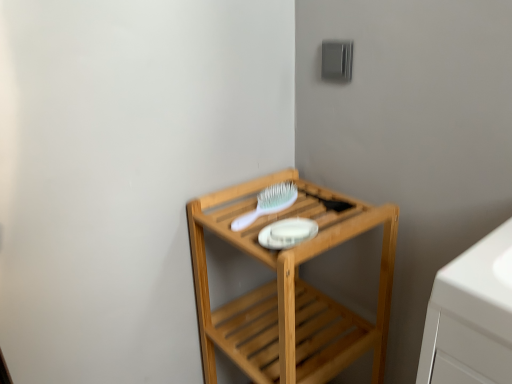
Question: Can you confirm if natural wood shelf at center is taller than white plastic brush at upper center?

Choices:
 (A) yes
 (B) no

Answer: (A)

Question: From the image's perspective, does natural wood shelf at center appear higher than white plastic brush at upper center?

Choices:
 (A) yes
 (B) no

Answer: (B)

Question: From a real-world perspective, is natural wood shelf at center beneath white plastic brush at upper center?

Choices:
 (A) yes
 (B) no

Answer: (A)

Question: Considering the relative positions of natural wood shelf at center and white plastic brush at upper center in the image provided, is natural wood shelf at center to the right of white plastic brush at upper center from the viewer's perspective?

Choices:
 (A) yes
 (B) no

Answer: (A)

Question: Does natural wood shelf at center turn towards white plastic brush at upper center?

Choices:
 (A) no
 (B) yes

Answer: (A)

Question: Is natural wood shelf at center positioned with its back to white plastic brush at upper center?

Choices:
 (A) no
 (B) yes

Answer: (A)

Question: Does white plastic brush at upper center have a lesser width compared to natural wood shelf at center?

Choices:
 (A) no
 (B) yes

Answer: (B)

Question: Is white plastic brush at upper center at the left side of natural wood shelf at center?

Choices:
 (A) yes
 (B) no

Answer: (A)

Question: Can you confirm if white plastic brush at upper center is shorter than natural wood shelf at center?

Choices:
 (A) no
 (B) yes

Answer: (B)

Question: Is the position of white plastic brush at upper center more distant than that of natural wood shelf at center?

Choices:
 (A) no
 (B) yes

Answer: (B)

Question: From the image's perspective, is white plastic brush at upper center located beneath natural wood shelf at center?

Choices:
 (A) yes
 (B) no

Answer: (B)

Question: Is white plastic brush at upper center smaller than natural wood shelf at center?

Choices:
 (A) no
 (B) yes

Answer: (B)

Question: In terms of height, does natural wood shelf at center look taller or shorter compared to white plastic brush at upper center?

Choices:
 (A) tall
 (B) short

Answer: (A)